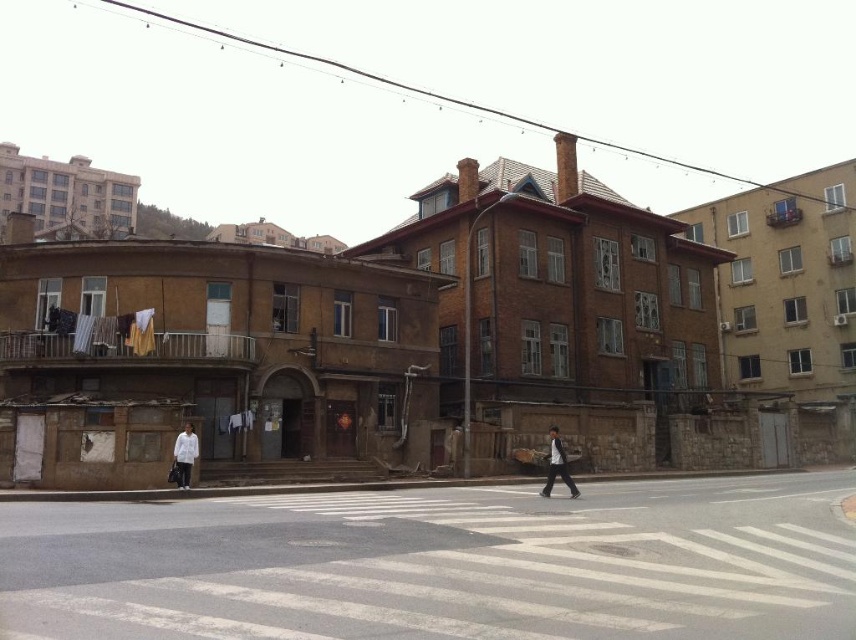
You are a delivery person with a 1.2 meter wide cart. You need to cross the street and pass through the white asphalt crosswalk at center. Can your cart fit through the space between the dark gray suit at center and the building on the left?

The white asphalt crosswalk at center might be wider than dark gray suit at center, so the cart could potentially fit, but there is uncertainty due to the possible width difference.

You are standing on the pedestrian crossing and want to walk towards the two points marked in the image. Which point, point (835, 522) or point (187, 422), is closer to you?

Point (835, 522) is closer to the viewer than point (187, 422), so you should walk towards point (835, 522) first.

You are a pedestrian standing at the point marked by coordinates point (441,564). Which object are you currently standing on?

The point (441,564) indicates the white asphalt crosswalk at center, so you are standing on the white asphalt crosswalk at center.